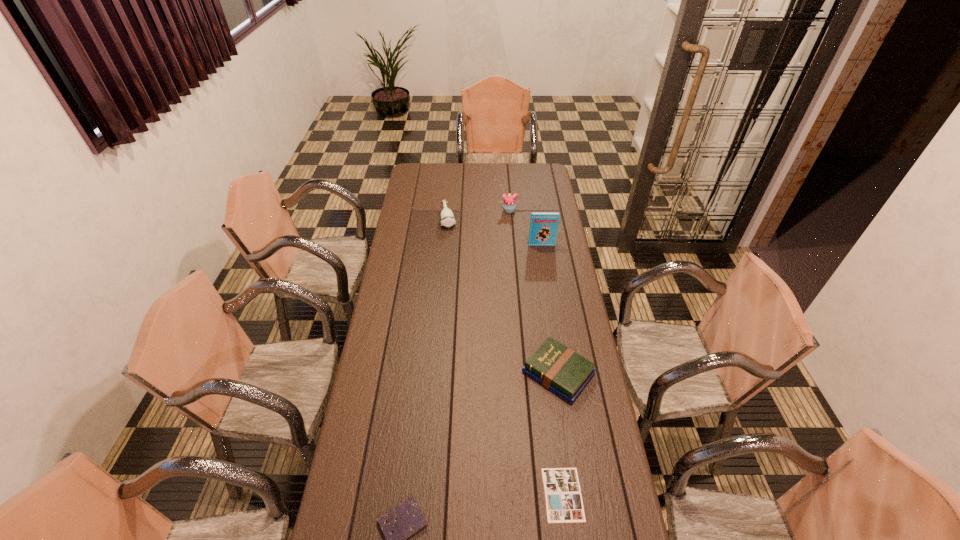
This screenshot has width=960, height=540. Find the location of `vacant region located on the right of the bottle`. vacant region located on the right of the bottle is located at coordinates (515, 218).

In order to click on vacant region located on the left of the third nearest object in this screenshot , I will do `click(489, 373)`.

Locate an element on the screen. free space located 0.300m on the back of the nearest book is located at coordinates (549, 389).

You are a GUI agent. You are given a task and a screenshot of the screen. Output one action in this format:
    pyautogui.click(x=<x>, y=<y>)
    Task: Click on the blank space at the left edge of the desktop
    This screenshot has width=960, height=540.
    Given the screenshot: What is the action you would take?
    pyautogui.click(x=373, y=417)

The height and width of the screenshot is (540, 960). What are the coordinates of `blank space at the right edge of the desktop` in the screenshot? It's located at (573, 294).

Locate an element on the screen. Image resolution: width=960 pixels, height=540 pixels. vacant space at the far right corner of the desktop is located at coordinates (531, 168).

Image resolution: width=960 pixels, height=540 pixels. Find the location of `empty space between the bottle and the shortest object`. empty space between the bottle and the shortest object is located at coordinates (506, 356).

Identify the location of empty space that is in between the shortest book and the third tallest object. The height and width of the screenshot is (540, 960). (506, 356).

The width and height of the screenshot is (960, 540). Identify the location of empty space that is in between the bottle and the third farthest object. (495, 231).

Locate an element on the screen. free spot between the shortest book and the second farthest book is located at coordinates (561, 434).